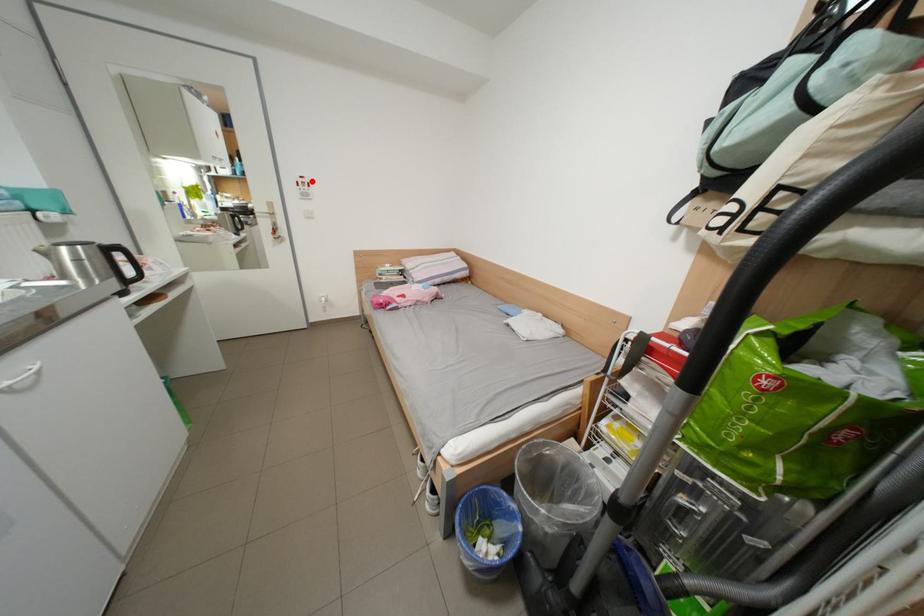
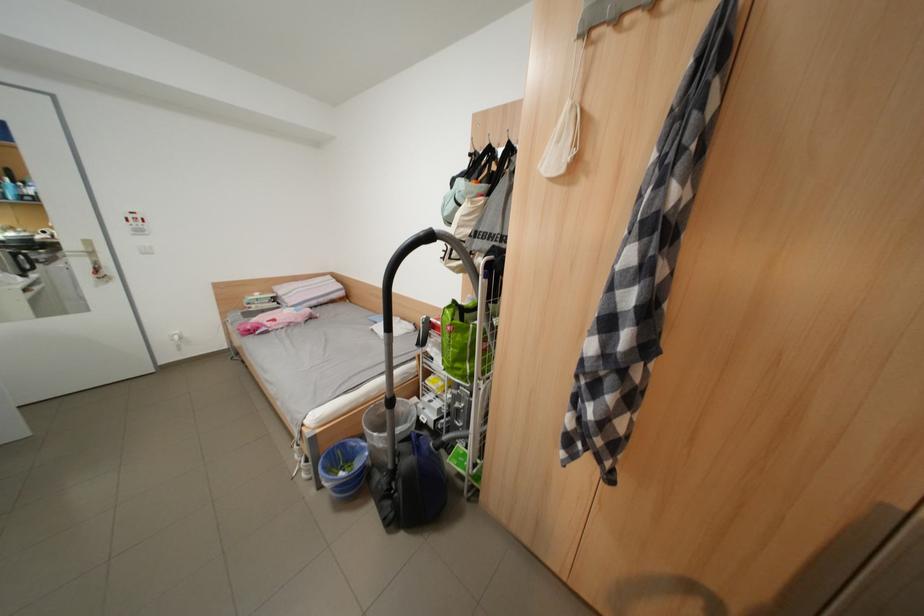
The point at the highlighted location is marked in the first image. Where is the corresponding point in the second image?

(142, 217)